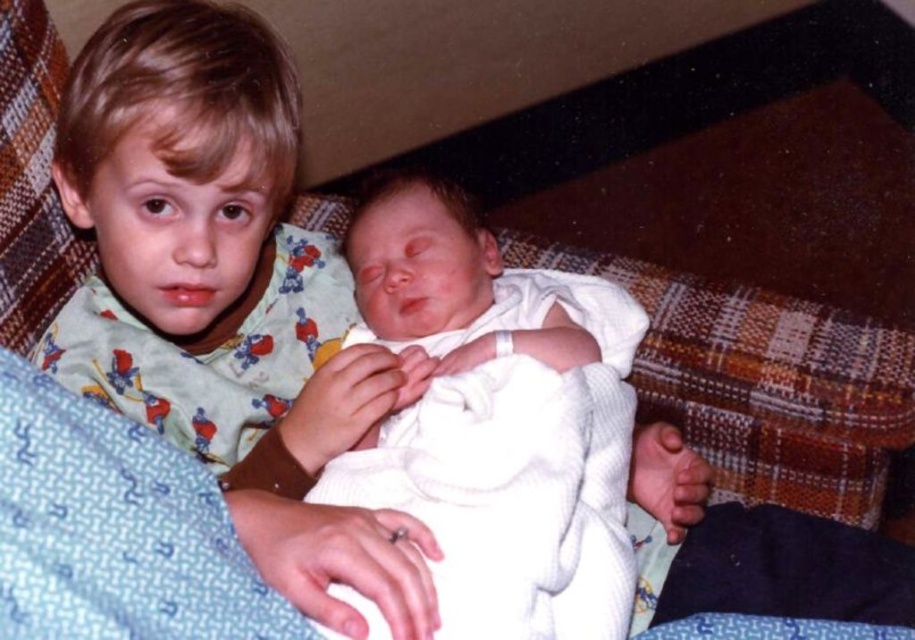
The height and width of the screenshot is (640, 915). What are the coordinates of `light green pajamas at upper left` in the screenshot? It's located at (202, 246).

Which of these two, light green pajamas at upper left or white knit baby at center, stands taller?

light green pajamas at upper left

Who is more distant from viewer, (192, 134) or (528, 296)?

Point (528, 296)

Where is `light green pajamas at upper left`? This screenshot has width=915, height=640. light green pajamas at upper left is located at coordinates (202, 246).